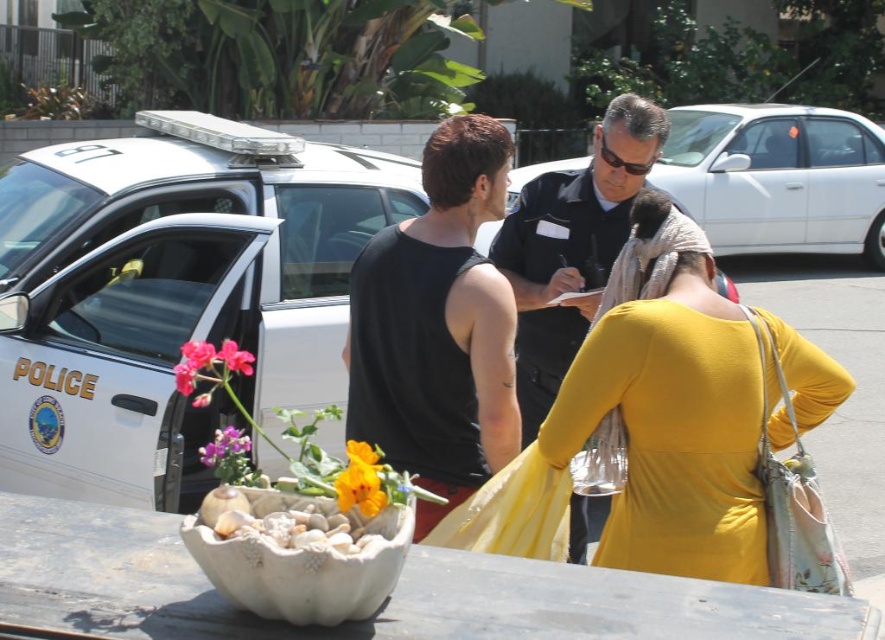
Can you confirm if matte yellow dress at center is bigger than matte pink flower at center?

Yes, matte yellow dress at center is bigger than matte pink flower at center.

Between matte yellow dress at center and matte pink flower at center, which one is positioned higher?

matte yellow dress at center

Is point (589, 429) positioned before point (248, 364)?

No.

Where is `matte yellow dress at center`? matte yellow dress at center is located at coordinates (674, 432).

Based on the photo, is matte yellow dress at center wider than white glossy sedan at center?

Incorrect, matte yellow dress at center's width does not surpass white glossy sedan at center's.

Does matte yellow dress at center appear under white glossy sedan at center?

Yes, matte yellow dress at center is below white glossy sedan at center.

Who is more distant from viewer, (794, 429) or (526, 164)?

The point (526, 164) is behind.

The image size is (885, 640). I want to click on matte yellow dress at center, so click(x=674, y=432).

Looking at this image, does white glossy police car at left lie in front of white glossy sedan at center?

Yes, it is.

Between white glossy police car at left and white glossy sedan at center, which one has more height?

white glossy sedan at center is taller.

Describe the element at coordinates (173, 294) in the screenshot. Image resolution: width=885 pixels, height=640 pixels. I see `white glossy police car at left` at that location.

This screenshot has height=640, width=885. I want to click on white glossy police car at left, so click(x=173, y=294).